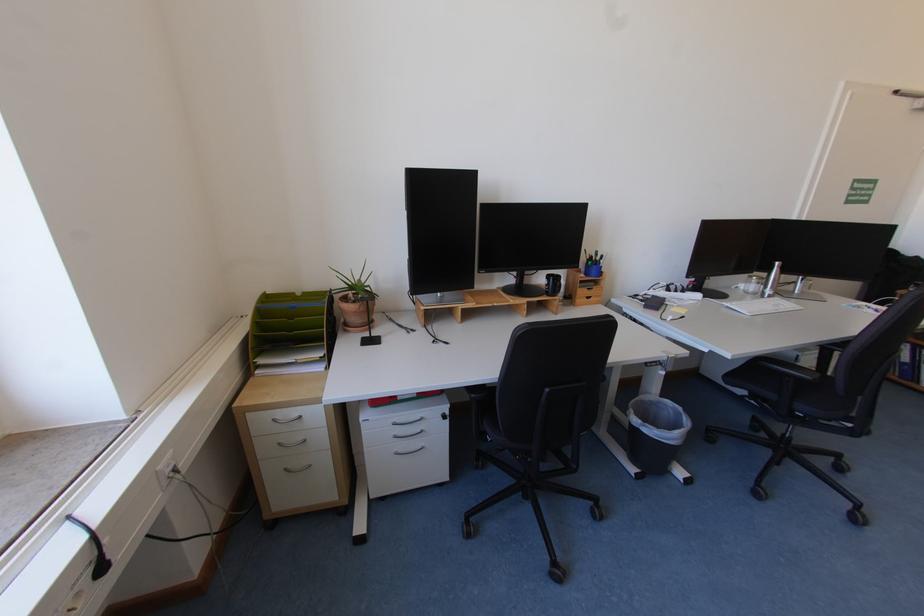
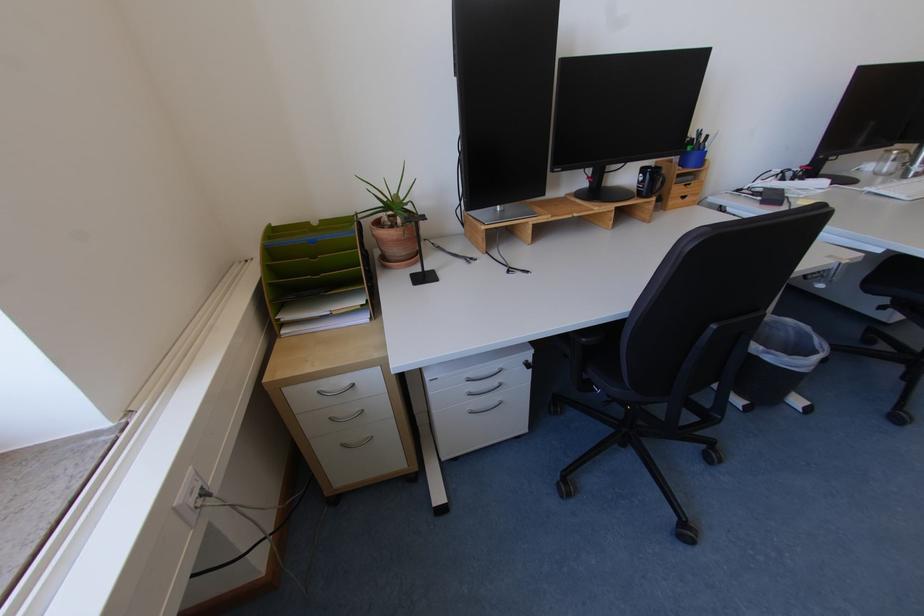
Locate, in the second image, the point that corresponds to point 555,277 in the first image.

(650, 171)